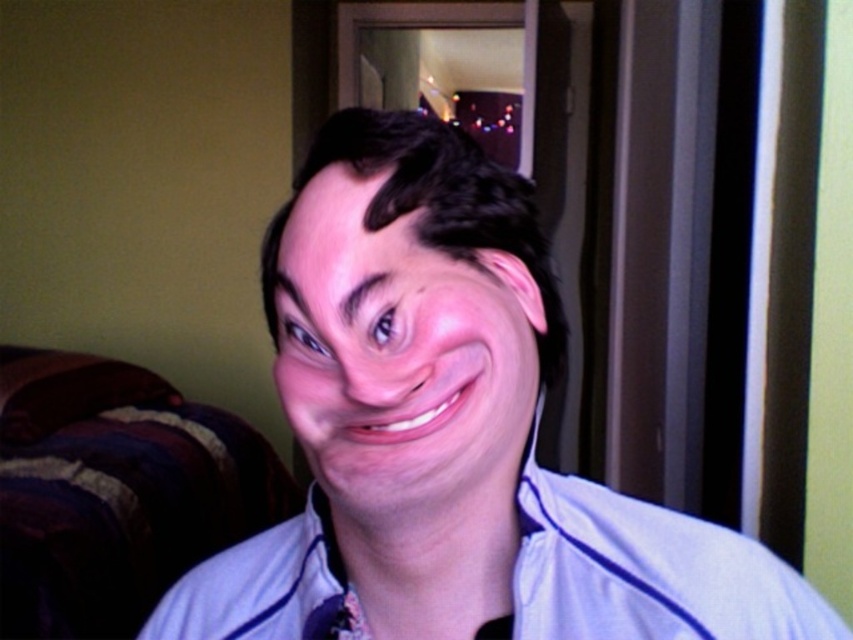
Is point (405, 276) behind point (495, 628)?

No, it is in front of (495, 628).

Between point (392, 218) and point (480, 628), which one is positioned in front?

Point (392, 218)

You are a GUI agent. You are given a task and a screenshot of the screen. Output one action in this format:
    pyautogui.click(x=<x>, y=<y>)
    Task: Click on the blue fabric shirt at center
    This screenshot has width=853, height=640.
    Given the screenshot: What is the action you would take?
    pyautogui.click(x=450, y=429)

I want to click on blue fabric shirt at center, so click(x=450, y=429).

Is blue fabric shirt at center positioned behind light blue fabric dress shirt at center?

No.

Between blue fabric shirt at center and light blue fabric dress shirt at center, which one appears on the left side from the viewer's perspective?

Positioned to the left is blue fabric shirt at center.

Locate an element on the screen. The width and height of the screenshot is (853, 640). blue fabric shirt at center is located at coordinates (450, 429).

What are the coordinates of `blue fabric shirt at center` in the screenshot? It's located at tap(450, 429).

Who is lower down, light blue fabric dress shirt at center or purple fabric at center?

Positioned lower is purple fabric at center.

Can you confirm if light blue fabric dress shirt at center is positioned above purple fabric at center?

Indeed, light blue fabric dress shirt at center is positioned over purple fabric at center.

At what (x,y) coordinates should I click in order to perform the action: click on light blue fabric dress shirt at center. Please return your answer as a coordinate pair (x, y). Looking at the image, I should click on (x=643, y=572).